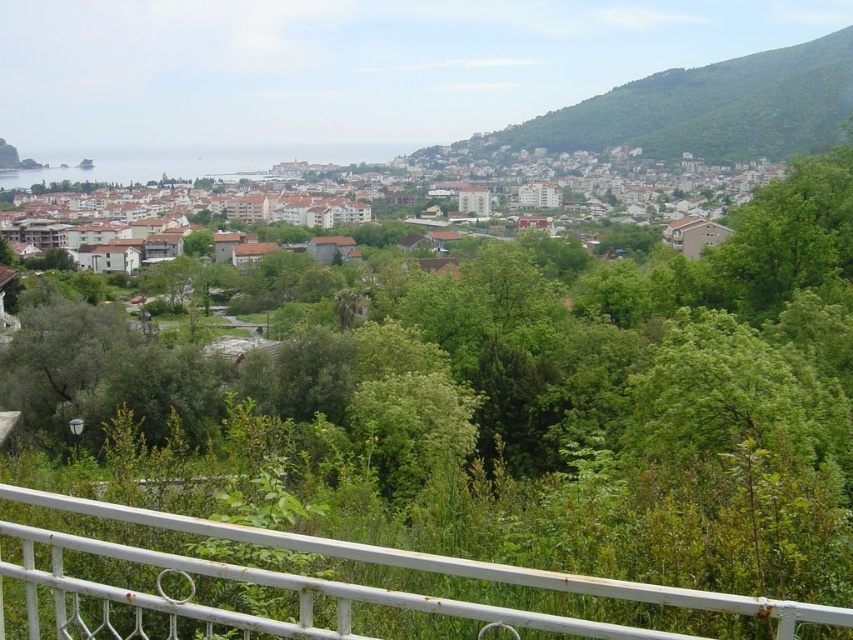
Question: Can you confirm if white metal railing at lower center is positioned to the right of white matte buildings at center?

Choices:
 (A) no
 (B) yes

Answer: (A)

Question: Which object appears farthest from the camera in this image?

Choices:
 (A) white matte buildings at center
 (B) white metal railing at lower center

Answer: (A)

Question: From the image, what is the correct spatial relationship of white metal railing at lower center in relation to white matte buildings at center?

Choices:
 (A) above
 (B) below

Answer: (B)

Question: Can you confirm if white metal railing at lower center is smaller than white matte buildings at center?

Choices:
 (A) yes
 (B) no

Answer: (A)

Question: Which point is farther from the camera taking this photo?

Choices:
 (A) tap(292, 204)
 (B) tap(16, 564)

Answer: (A)

Question: Which of the following is the closest to the observer?

Choices:
 (A) white metal railing at lower center
 (B) white matte buildings at center

Answer: (A)